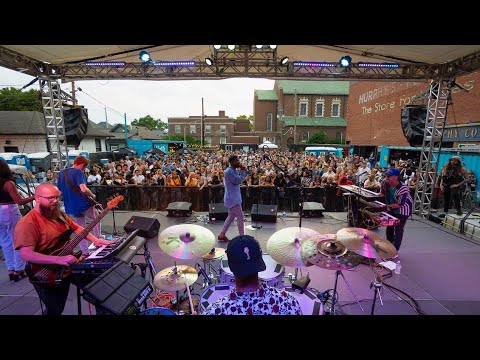
Where is `keyboard`? The width and height of the screenshot is (480, 360). keyboard is located at coordinates (367, 202).